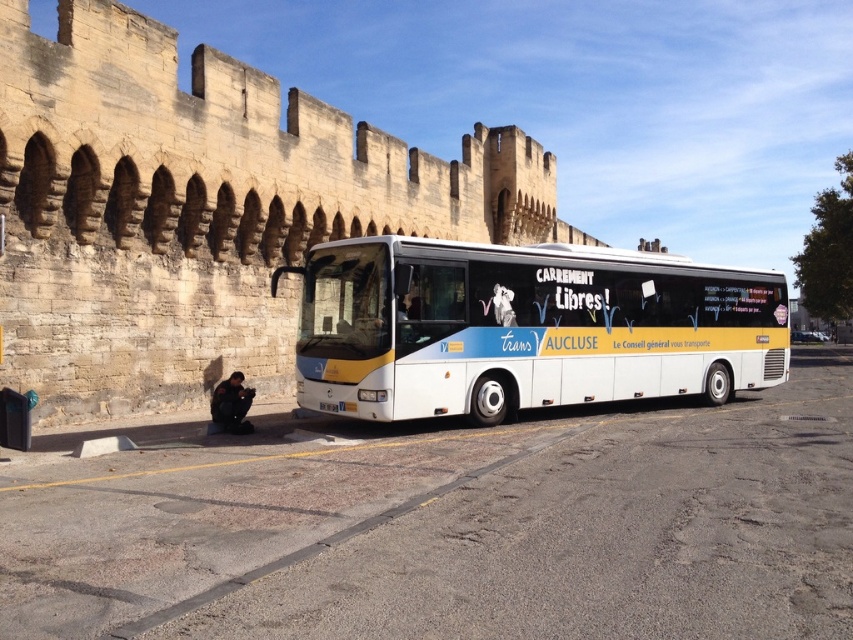
Question: Is stone wall at center above white glossy bus at center?

Choices:
 (A) yes
 (B) no

Answer: (A)

Question: Observing the image, what is the correct spatial positioning of stone wall at center in reference to white glossy bus at center?

Choices:
 (A) above
 (B) below

Answer: (A)

Question: Which of the following is the closest to the observer?

Choices:
 (A) (300, 161)
 (B) (12, 397)

Answer: (B)

Question: Can you confirm if white glossy bus at center is positioned to the right of smooth black surface at lower left?

Choices:
 (A) no
 (B) yes

Answer: (B)

Question: Which of the following is the farthest from the observer?

Choices:
 (A) (459, 384)
 (B) (224, 65)
 (C) (1, 445)

Answer: (B)

Question: Which point is farther from the camera taking this photo?

Choices:
 (A) (461, 406)
 (B) (495, 202)
 (C) (24, 412)

Answer: (B)